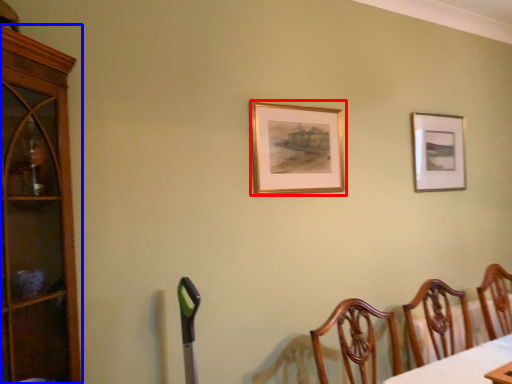
Question: Among these objects, which one is farthest to the camera, picture frame (highlighted by a red box) or cabinetry (highlighted by a blue box)?

Choices:
 (A) picture frame
 (B) cabinetry

Answer: (A)